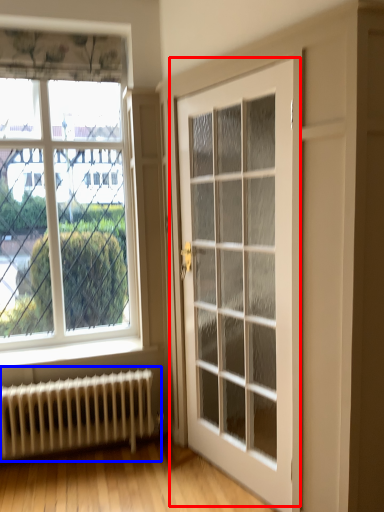
Question: Which point is closer to the camera, door (highlighted by a red box) or radiator (highlighted by a blue box)?

Choices:
 (A) door
 (B) radiator

Answer: (A)